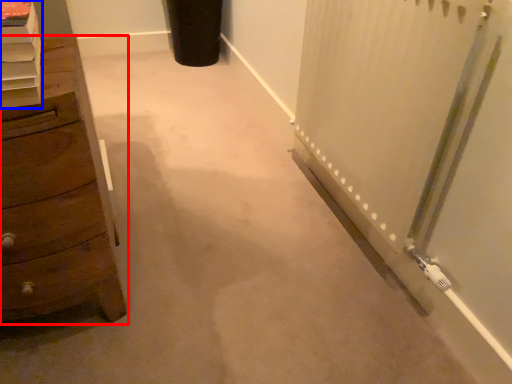
Question: Which object appears closest to the camera in this image, chest of drawers (highlighted by a red box) or shelf (highlighted by a blue box)?

Choices:
 (A) chest of drawers
 (B) shelf

Answer: (B)